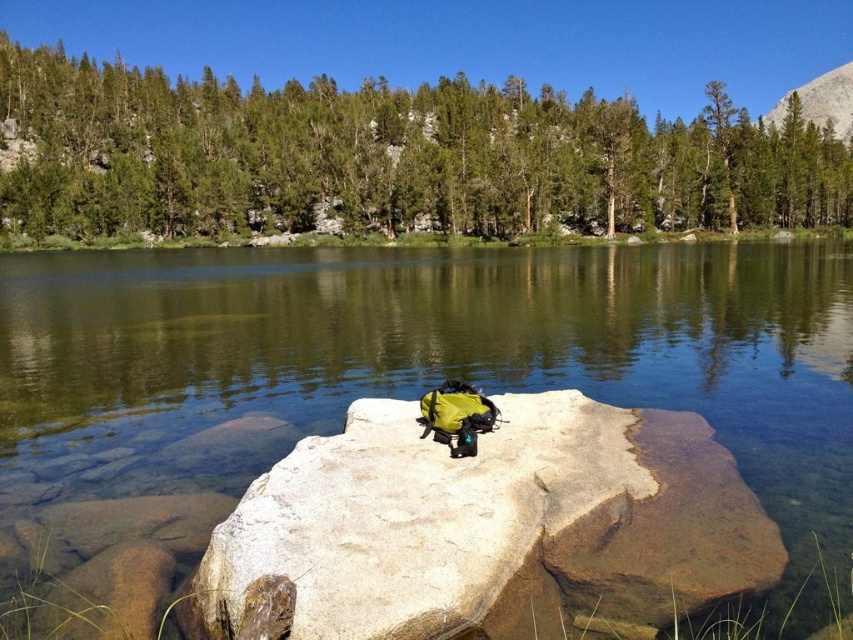
Measure the distance between green matte rock at center and camera.

The distance of green matte rock at center from camera is 26.09 meters.

Is point (28, 291) behind point (306, 545)?

Yes, point (28, 291) is farther from viewer.

Find the location of a particular element. The width and height of the screenshot is (853, 640). green matte rock at center is located at coordinates (428, 364).

The image size is (853, 640). Find the location of `green matte rock at center`. green matte rock at center is located at coordinates (428, 364).